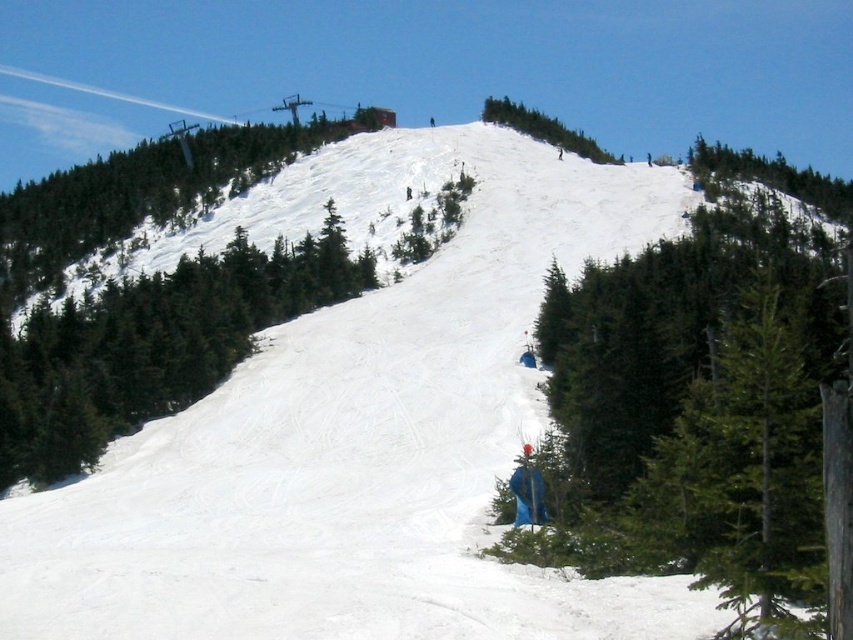
Question: Does green matte tree at center appear on the right side of green textured tree at upper center?

Choices:
 (A) no
 (B) yes

Answer: (A)

Question: Which object appears farthest from the camera in this image?

Choices:
 (A) green textured tree at upper left
 (B) green matte tree at center
 (C) green textured tree at upper right
 (D) green matte tree at lower right

Answer: (A)

Question: Which is nearer to the green textured tree at upper left?

Choices:
 (A) green textured tree at upper right
 (B) green matte tree at lower right

Answer: (B)

Question: Does green textured tree at upper right have a smaller size compared to green textured tree at upper center?

Choices:
 (A) no
 (B) yes

Answer: (A)

Question: Which point is farther to the camera?

Choices:
 (A) green textured tree at upper center
 (B) green matte tree at center
 (C) green matte tree at lower right

Answer: (A)

Question: Can you confirm if green matte tree at center is wider than green textured tree at upper right?

Choices:
 (A) yes
 (B) no

Answer: (B)